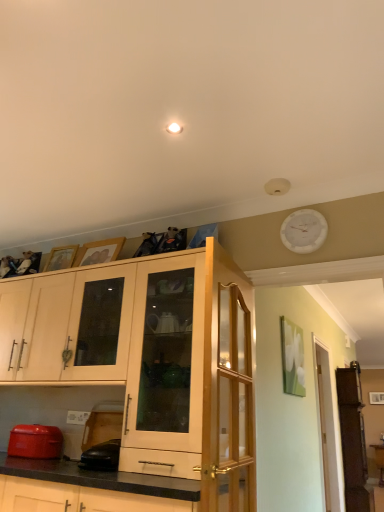
Where is `white plastic clock at upper right`? This screenshot has height=512, width=384. white plastic clock at upper right is located at coordinates (304, 231).

What do you see at coordinates (166, 356) in the screenshot? I see `matte wood cabinet at center, acting as the 1th cabinetry starting from the right` at bounding box center [166, 356].

This screenshot has height=512, width=384. Identify the location of clear glass door at right, positioned as the second glass door in front-to-back order. (327, 426).

Measure the distance between point (87,420) and camera.

9.05 feet.

Locate an element on the screen. This screenshot has width=384, height=512. matte red toaster at lower left, which is the second appliance from right to left is located at coordinates (35, 441).

Measure the distance between matte wood cabinets at upper left, marked as the second cabinetry in a right-to-left arrangement, and clear wood glass door at upper center, the first glass door when ordered from front to back.

matte wood cabinets at upper left, marked as the second cabinetry in a right-to-left arrangement, is 96.66 centimeters away from clear wood glass door at upper center, the first glass door when ordered from front to back.

Which is behind, matte wood cabinets at upper left, positioned as the first cabinetry in left-to-right order, or clear wood glass door at upper center, marked as the second glass door in a right-to-left arrangement?

matte wood cabinets at upper left, positioned as the first cabinetry in left-to-right order, is further from the camera.

Which is in front, point (36, 296) or point (205, 394)?

The point (205, 394) is closer.

Is matte wood cabinets at upper left, positioned as the first cabinetry in left-to-right order, thinner than clear wood glass door at upper center, which is counted as the 1th glass door, starting from the left?

Incorrect, the width of matte wood cabinets at upper left, positioned as the first cabinetry in left-to-right order, is not less than that of clear wood glass door at upper center, which is counted as the 1th glass door, starting from the left.

Is white plastic clock at upper right in front of matte red toaster at lower left, which is the second appliance from right to left?

Yes, the depth of white plastic clock at upper right is less than that of matte red toaster at lower left, which is the second appliance from right to left.

Considering the relative positions of white plastic clock at upper right and matte red toaster at lower left, marked as the first appliance in a left-to-right arrangement, in the image provided, is white plastic clock at upper right to the left or to the right of matte red toaster at lower left, marked as the first appliance in a left-to-right arrangement,?

white plastic clock at upper right is positioned on matte red toaster at lower left, marked as the first appliance in a left-to-right arrangement,'s right side.

The height and width of the screenshot is (512, 384). In order to click on clock that is on the right side of matte red toaster at lower left, which is the second appliance from right to left in this screenshot , I will do `click(304, 231)`.

From a real-world perspective, relative to matte red toaster at lower left, marked as the first appliance in a left-to-right arrangement, is white plastic clock at upper right vertically above or below?

white plastic clock at upper right is above matte red toaster at lower left, marked as the first appliance in a left-to-right arrangement.

Which object is positioned more to the left, black rubber mouse at lower left, the 1th appliance positioned from the right, or clear glass door at right, positioned as the second glass door in front-to-back order?

Positioned to the left is black rubber mouse at lower left, the 1th appliance positioned from the right.

Who is more distant, black rubber mouse at lower left, which ranks as the 2th appliance in left-to-right order, or clear glass door at right, positioned as the 1th glass door in right-to-left order?

clear glass door at right, positioned as the 1th glass door in right-to-left order, is further away from the camera.

Identify the location of glass door behind the black rubber mouse at lower left, which ranks as the 2th appliance in left-to-right order. The width and height of the screenshot is (384, 512). (327, 426).

Does matte red toaster at lower left, marked as the first appliance in a left-to-right arrangement, have a smaller size compared to matte wood cabinet at center, the 2th cabinetry positioned from the left?

Yes, matte red toaster at lower left, marked as the first appliance in a left-to-right arrangement, is smaller than matte wood cabinet at center, the 2th cabinetry positioned from the left.

Visually, is matte red toaster at lower left, marked as the first appliance in a left-to-right arrangement, positioned to the left or to the right of matte wood cabinet at center, the 2th cabinetry positioned from the left?

matte red toaster at lower left, marked as the first appliance in a left-to-right arrangement, is to the left of matte wood cabinet at center, the 2th cabinetry positioned from the left.

Would you say matte red toaster at lower left, which is the second appliance from right to left, is inside or outside matte wood cabinet at center, the 2th cabinetry positioned from the left?

matte red toaster at lower left, which is the second appliance from right to left, cannot be found inside matte wood cabinet at center, the 2th cabinetry positioned from the left.

Could you tell me if matte red toaster at lower left, marked as the first appliance in a left-to-right arrangement, is facing matte wood cabinet at center, acting as the 1th cabinetry starting from the right?

No.

Find the location of a particular element. The image size is (384, 512). glass door lying in front of the matte wood cabinet at center, the 2th cabinetry positioned from the left is located at coordinates (228, 400).

Considering the relative sizes of matte wood cabinet at center, the 2th cabinetry positioned from the left, and clear wood glass door at upper center, marked as the second glass door in a right-to-left arrangement, in the image provided, is matte wood cabinet at center, the 2th cabinetry positioned from the left, bigger than clear wood glass door at upper center, marked as the second glass door in a right-to-left arrangement,?

Correct, matte wood cabinet at center, the 2th cabinetry positioned from the left, is larger in size than clear wood glass door at upper center, marked as the second glass door in a right-to-left arrangement.

Is matte wood cabinet at center, the 2th cabinetry positioned from the left, aimed at clear wood glass door at upper center, marked as the second glass door in a right-to-left arrangement?

No, matte wood cabinet at center, the 2th cabinetry positioned from the left, does not turn towards clear wood glass door at upper center, marked as the second glass door in a right-to-left arrangement.

Is white plastic clock at upper right outside of matte wood cabinet at center, the 2th cabinetry positioned from the left?

Indeed, white plastic clock at upper right is completely outside matte wood cabinet at center, the 2th cabinetry positioned from the left.

Between white plastic clock at upper right and matte wood cabinet at center, the 2th cabinetry positioned from the left, which one has larger width?

matte wood cabinet at center, the 2th cabinetry positioned from the left, is wider.

How different are the orientations of white plastic clock at upper right and matte wood cabinet at center, the 2th cabinetry positioned from the left, in degrees?

white plastic clock at upper right and matte wood cabinet at center, the 2th cabinetry positioned from the left, are facing 0.0587 degrees away from each other.

From the picture: From a real-world perspective, is white plastic clock at upper right physically located above or below matte wood cabinet at center, the 2th cabinetry positioned from the left?

white plastic clock at upper right is situated higher than matte wood cabinet at center, the 2th cabinetry positioned from the left, in the real world.

Between matte wood cabinets at upper left, positioned as the first cabinetry in left-to-right order, and matte wood cabinet at center, the 2th cabinetry positioned from the left, which one has more height?

matte wood cabinet at center, the 2th cabinetry positioned from the left.

How much distance is there between matte wood cabinets at upper left, positioned as the first cabinetry in left-to-right order, and matte wood cabinet at center, acting as the 1th cabinetry starting from the right?

They are 18.42 inches apart.

Who is smaller, matte wood cabinets at upper left, positioned as the first cabinetry in left-to-right order, or matte wood cabinet at center, acting as the 1th cabinetry starting from the right?

Smaller between the two is matte wood cabinet at center, acting as the 1th cabinetry starting from the right.

Locate an element on the screen. cabinetry that appears in front of the matte wood cabinets at upper left, marked as the second cabinetry in a right-to-left arrangement is located at coordinates (166, 356).

Which cabinetry is the 2nd one when counting from the left side of the clear wood glass door at upper center, which is counted as the 1th glass door, starting from the left? Please provide its 2D coordinates.

[(67, 326)]

The height and width of the screenshot is (512, 384). Identify the location of clock above the matte red toaster at lower left, which is the second appliance from right to left (from the image's perspective). (304, 231).

Considering their positions, is matte wood cabinet at center, acting as the 1th cabinetry starting from the right, positioned closer to clear wood glass door at upper center, marked as the second glass door in a right-to-left arrangement, than white plastic clock at upper right?

The object closer to clear wood glass door at upper center, marked as the second glass door in a right-to-left arrangement, is matte wood cabinet at center, acting as the 1th cabinetry starting from the right.

Considering their positions, is matte red toaster at lower left, which is the second appliance from right to left, positioned closer to white plastic clock at upper right than matte wood cabinet at center, acting as the 1th cabinetry starting from the right?

matte wood cabinet at center, acting as the 1th cabinetry starting from the right.

From the image, which object appears to be farther from matte wood cabinets at upper left, marked as the second cabinetry in a right-to-left arrangement, clear wood glass door at upper center, marked as the second glass door in a right-to-left arrangement, or matte wood cabinet at center, acting as the 1th cabinetry starting from the right?

Among the two, clear wood glass door at upper center, marked as the second glass door in a right-to-left arrangement, is located further to matte wood cabinets at upper left, marked as the second cabinetry in a right-to-left arrangement.

Estimate the real-world distances between objects in this image. Which object is closer to clear glass door at right, which is the 2th glass door in left-to-right order, black rubber mouse at lower left, the 1th appliance positioned from the right, or matte wood cabinets at upper left, marked as the second cabinetry in a right-to-left arrangement?

Based on the image, black rubber mouse at lower left, the 1th appliance positioned from the right, appears to be nearer to clear glass door at right, which is the 2th glass door in left-to-right order.

Which object lies further to the anchor point black rubber mouse at lower left, the 1th appliance positioned from the right, clear wood glass door at upper center, marked as the second glass door in a right-to-left arrangement, or matte wood cabinets at upper left, positioned as the first cabinetry in left-to-right order?

clear wood glass door at upper center, marked as the second glass door in a right-to-left arrangement, is positioned further to the anchor black rubber mouse at lower left, the 1th appliance positioned from the right.

From the image, which object appears to be farther from clear glass door at right, positioned as the second glass door in front-to-back order, matte wood cabinet at center, the 2th cabinetry positioned from the left, or white plastic clock at upper right?

white plastic clock at upper right.

From the image, which object appears to be farther from black rubber mouse at lower left, the 1th appliance positioned from the right, matte red toaster at lower left, which is the second appliance from right to left, or matte wood cabinets at upper left, positioned as the first cabinetry in left-to-right order?

matte wood cabinets at upper left, positioned as the first cabinetry in left-to-right order, is further to black rubber mouse at lower left, the 1th appliance positioned from the right.

When comparing their distances from clear glass door at right, positioned as the 1th glass door in right-to-left order, does matte wood cabinets at upper left, marked as the second cabinetry in a right-to-left arrangement, or white plastic clock at upper right seem closer?

white plastic clock at upper right lies closer to clear glass door at right, positioned as the 1th glass door in right-to-left order, than the other object.

You are a GUI agent. You are given a task and a screenshot of the screen. Output one action in this format:
    pyautogui.click(x=<x>, y=<y>)
    Task: Click on the clock between matte red toaster at lower left, which is the second appliance from right to left, and clear glass door at right, positioned as the second glass door in front-to-back order
    This screenshot has height=512, width=384.
    Given the screenshot: What is the action you would take?
    pyautogui.click(x=304, y=231)

Where is `appliance between matte red toaster at lower left, marked as the first appliance in a left-to-right arrangement, and clear wood glass door at upper center, the first glass door when ordered from front to back, in the horizontal direction`? The height and width of the screenshot is (512, 384). appliance between matte red toaster at lower left, marked as the first appliance in a left-to-right arrangement, and clear wood glass door at upper center, the first glass door when ordered from front to back, in the horizontal direction is located at coordinates (103, 423).

At what (x,y) coordinates should I click in order to perform the action: click on appliance between matte red toaster at lower left, marked as the first appliance in a left-to-right arrangement, and clear glass door at right, which is the 2th glass door in left-to-right order, in the horizontal direction. Please return your answer as a coordinate pair (x, y). Looking at the image, I should click on (103, 423).

You are a GUI agent. You are given a task and a screenshot of the screen. Output one action in this format:
    pyautogui.click(x=<x>, y=<y>)
    Task: Click on the glass door between matte red toaster at lower left, which is the second appliance from right to left, and clear glass door at right, positioned as the second glass door in front-to-back order
    The width and height of the screenshot is (384, 512).
    Given the screenshot: What is the action you would take?
    pyautogui.click(x=228, y=400)